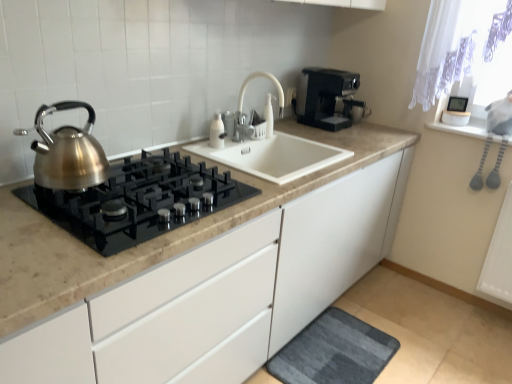
The width and height of the screenshot is (512, 384). I want to click on empty space that is to the right of brushed metal kettle at left, so click(x=139, y=180).